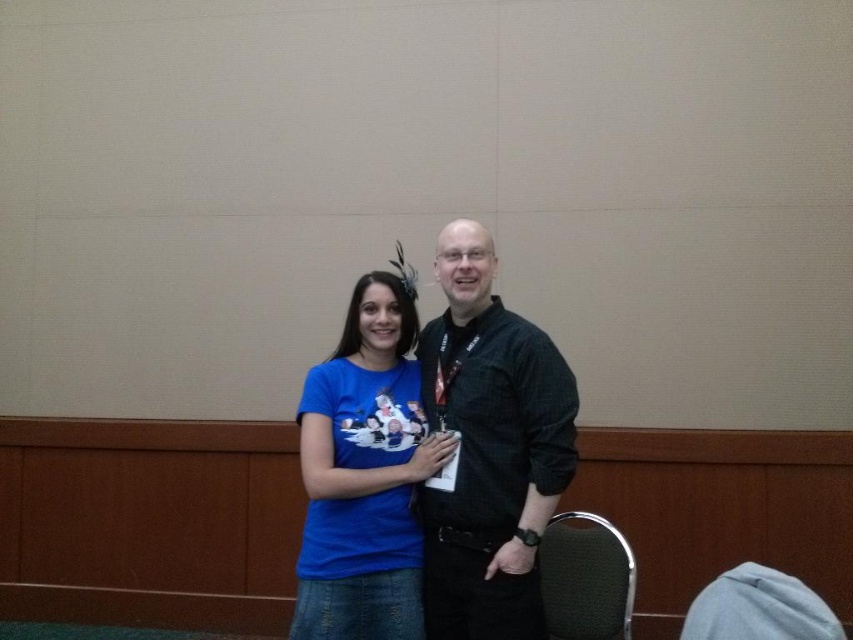
You are standing in a conference room and want to take a photo of the point at coordinates (x=454, y=387). The camera you are using has a minimum focus distance of 2 meters. Will the camera be able to focus on the point?

The point at coordinates (x=454, y=387) is 2.09 meters away from the camera. Since the minimum focus distance is 2 meters, the camera can focus on the point as it is slightly beyond the minimum required distance.

You are standing in the conference room and see the black textured shirt at center. If you were to walk directly towards it from your current position, which direction should you move relative to the beige wall with wooden panel at the bottom?

The black textured shirt at center is located at point 0.702 on the x axis and 0.574 on the y axis. Since the beige wall with wooden panel at the bottom is the reference point, moving towards the shirt would require moving towards the right and slightly forward.

You are a photographer trying to capture the blue cotton t shirt at center in a close up shot. You are currently standing at point (364, 474). Can you take the photo without moving your position?

Yes, you can take the photo without moving because the blue cotton t shirt at center is located exactly at your current position of point (364, 474).